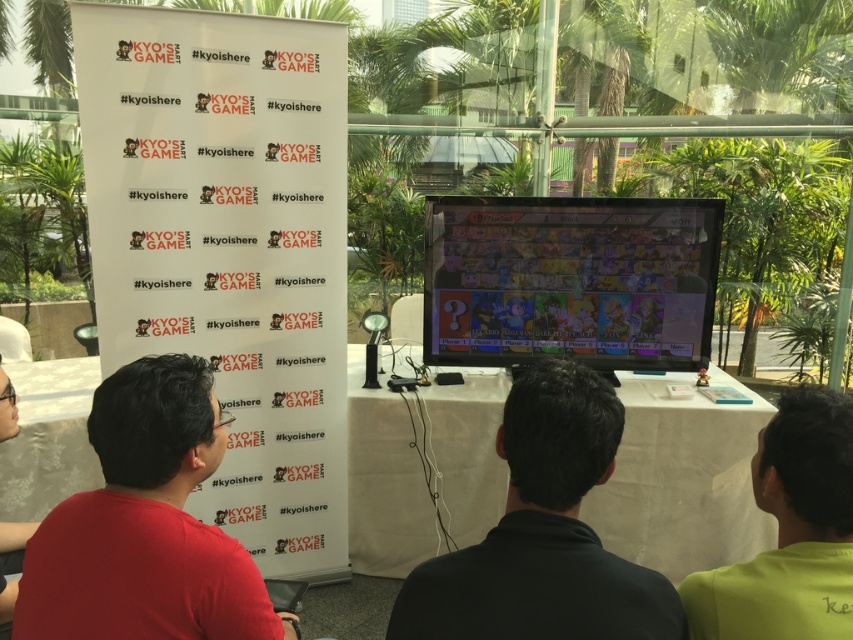
You are a photographer at the gaming event. You want to take a photo of the black matte shirt at center without the matte plastic tv at center blocking it. How should you adjust your position?

To capture the black matte shirt at center without the matte plastic tv at center blocking it, move to a position where you can see the black matte shirt at center in front of the matte plastic tv at center. Since the black matte shirt at center is behind the matte plastic tv at center, moving to the side or adjusting the angle would allow the shirt to be visible without obstruction.

You are a game developer analyzing the setup of the gaming event. The event requires placing a new monitor that must be positioned exactly at the center of the current setup. Is the existing monitor at point (570, 280) already centered?

The point (570, 280) marks the matte plastic TV at center, so yes, the existing monitor at point (570, 280) is already centered in the current setup.

You are a photographer standing 5 feet away from the black matte shirt at center and green matte shirt at lower right. You want to take a photo that includes both shirts in the frame. Given that your camera has a maximum horizontal field of view of 10 inches at this distance, will both shirts fit in the frame?

The black matte shirt at center and green matte shirt at lower right are 10.96 inches apart from each other. Since the camera has a maximum horizontal field of view of 10 inches at this distance, the shirts are slightly too far apart to fit within the frame.